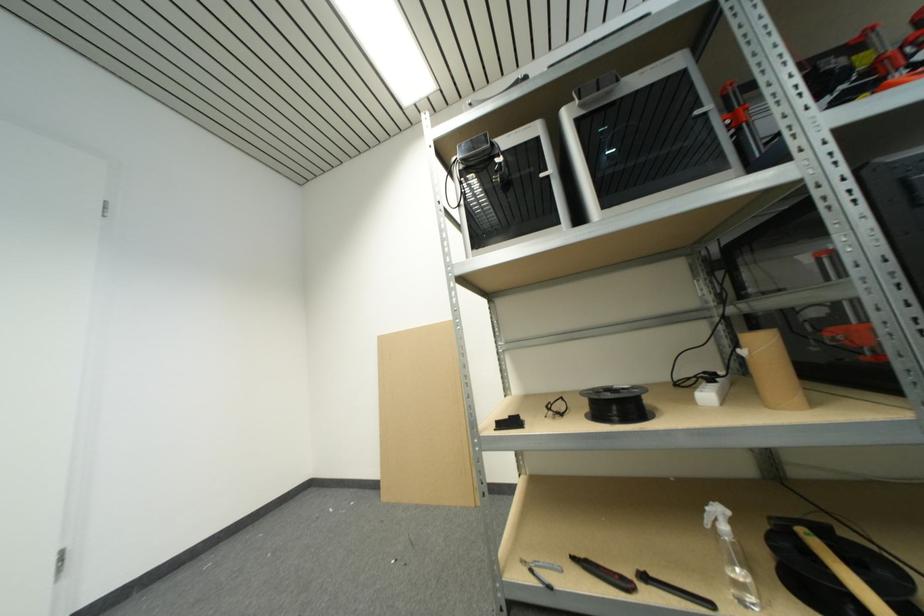
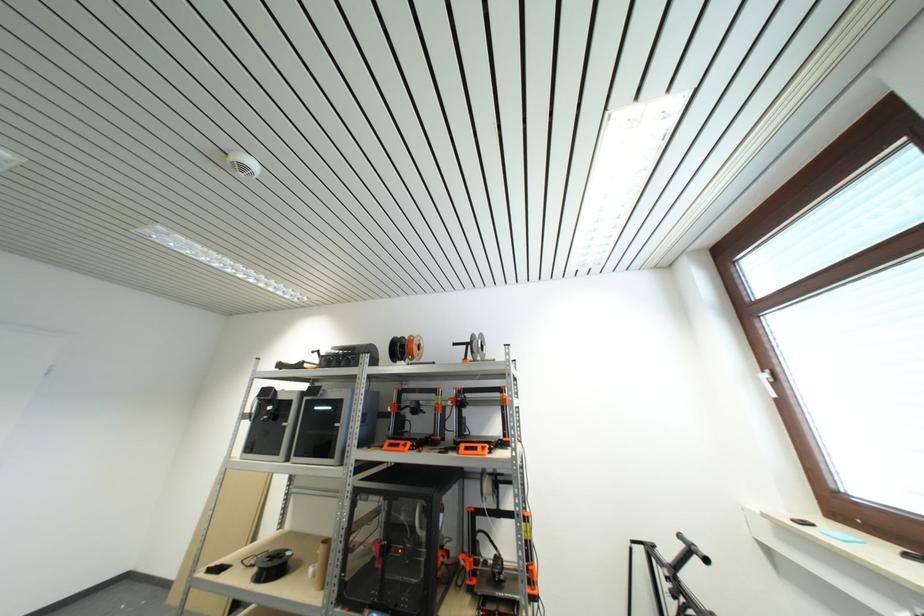
In a continuous first-person perspective shot, in which direction is the camera moving?

The cameraman moved toward right, backward.